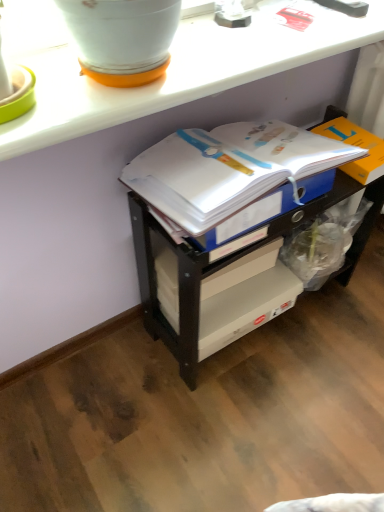
Question: Is white paper journal at center wider or thinner than white glossy flowerpot at upper left?

Choices:
 (A) thin
 (B) wide

Answer: (B)

Question: Is white paper journal at center inside the boundaries of white glossy flowerpot at upper left, or outside?

Choices:
 (A) outside
 (B) inside

Answer: (A)

Question: Which object is positioned farthest from the white glossy flowerpot at upper left?

Choices:
 (A) white plastic shelf at center
 (B) orange cardboard box at right
 (C) white paper journal at center
 (D) white glossy counter at upper center

Answer: (A)

Question: Estimate the real-world distances between objects in this image. Which object is closer to the white glossy flowerpot at upper left?

Choices:
 (A) white plastic shelf at center
 (B) white glossy counter at upper center
 (C) white paper journal at center
 (D) orange cardboard box at right

Answer: (B)